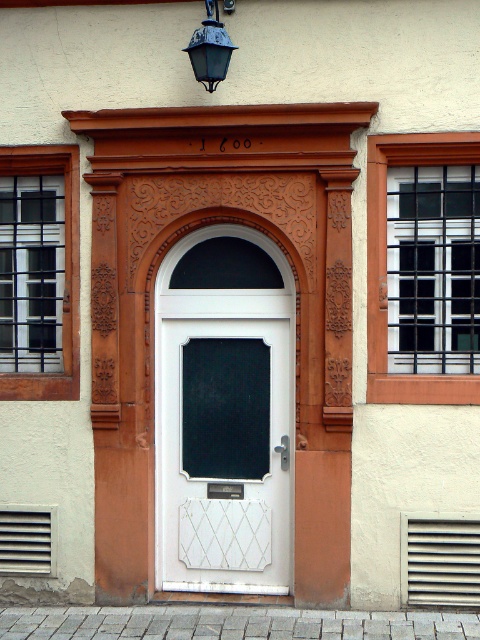
Is matte black glass at left behind matte black lantern at upper center?

That is True.

Between matte black glass at left and matte black lantern at upper center, which one appears on the left side from the viewer's perspective?

Positioned to the left is matte black glass at left.

What do you see at coordinates (38, 273) in the screenshot? I see `matte black glass at left` at bounding box center [38, 273].

I want to click on matte black glass at left, so click(x=38, y=273).

Who is taller, matte black glass at left or black metal bars at right?

With more height is black metal bars at right.

Is point (39, 252) closer to camera compared to point (370, 348)?

No, (39, 252) is further to viewer.

The height and width of the screenshot is (640, 480). Describe the element at coordinates (38, 273) in the screenshot. I see `matte black glass at left` at that location.

Where is `matte black glass at left`? Image resolution: width=480 pixels, height=640 pixels. matte black glass at left is located at coordinates (38, 273).

Is white glossy door at center further to the viewer compared to matte black glass at left?

Yes, it is behind matte black glass at left.

Is white glossy door at center thinner than matte black glass at left?

Incorrect, white glossy door at center's width is not less than matte black glass at left's.

Which is behind, point (252, 513) or point (37, 310)?

The point (37, 310) is more distant.

In order to click on white glossy door at center in this screenshot , I will do `click(223, 452)`.